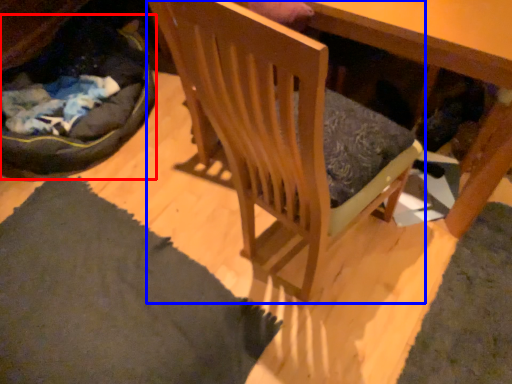
Question: Which point is further to the camera, cat bed (highlighted by a red box) or chair (highlighted by a blue box)?

Choices:
 (A) cat bed
 (B) chair

Answer: (A)